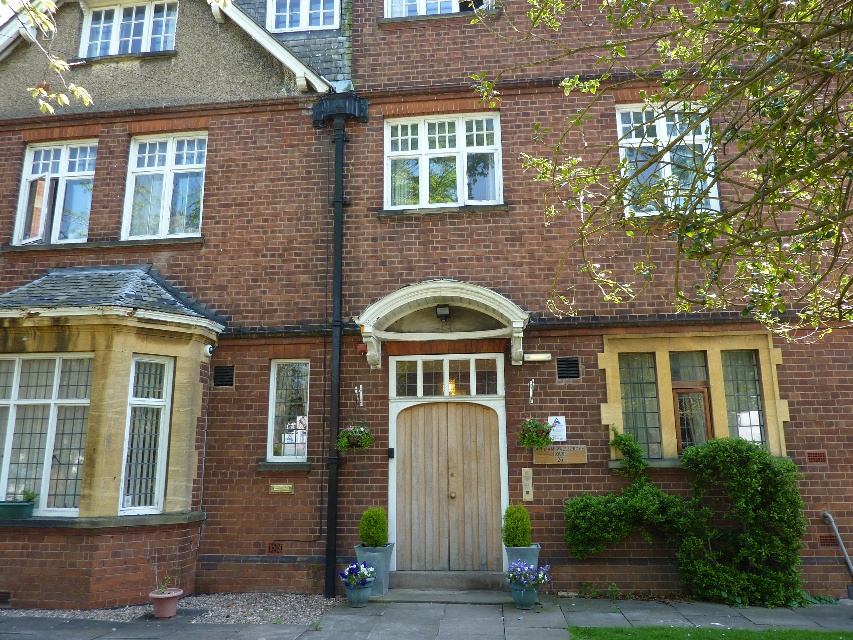
You are standing in front of the two story brick building and need to enter through the natural wood door at center. However, there is a black metal pipe at center in the way. Can you walk straight to the door without moving the pipe?

The natural wood door at center is in front of the black metal pipe at center, so you can walk straight to the door without moving the pipe because the door is closer to you than the pipe.

You are a delivery person trying to deliver a package to the natural wood door at center. However, there is a black metal pipe at center in the way. Can you pass through the space between them to reach the door?

The natural wood door at center is wider than the black metal pipe at center. Since both are at the center, the door likely extends beyond the pipe on both sides, allowing you to walk around the pipe and reach the door without issue.

You are a delivery person trying to enter the building. You see the natural wood door at center and the black metal pipe at center. Which object is closer to the ground?

The natural wood door at center is positioned under the black metal pipe at center, so the natural wood door at center is closer to the ground.